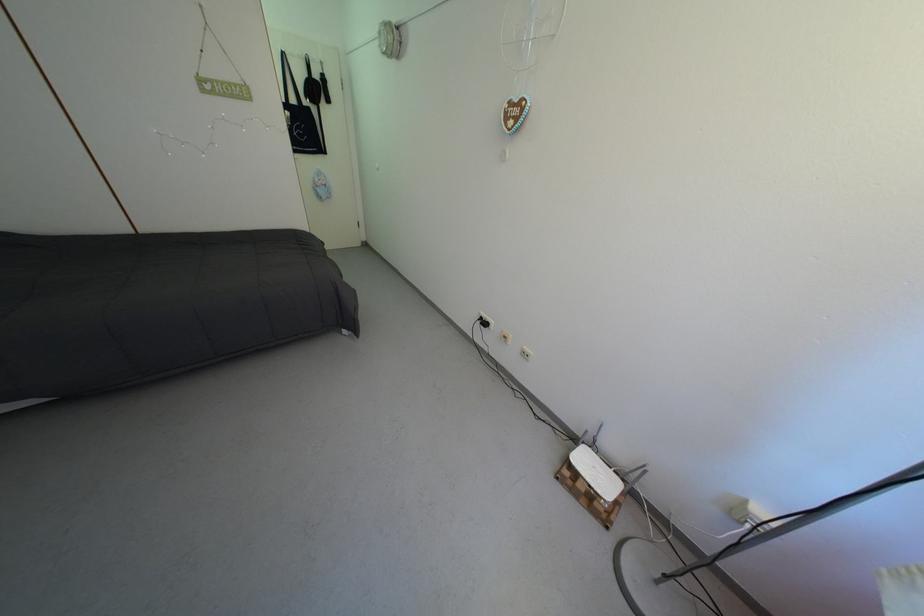
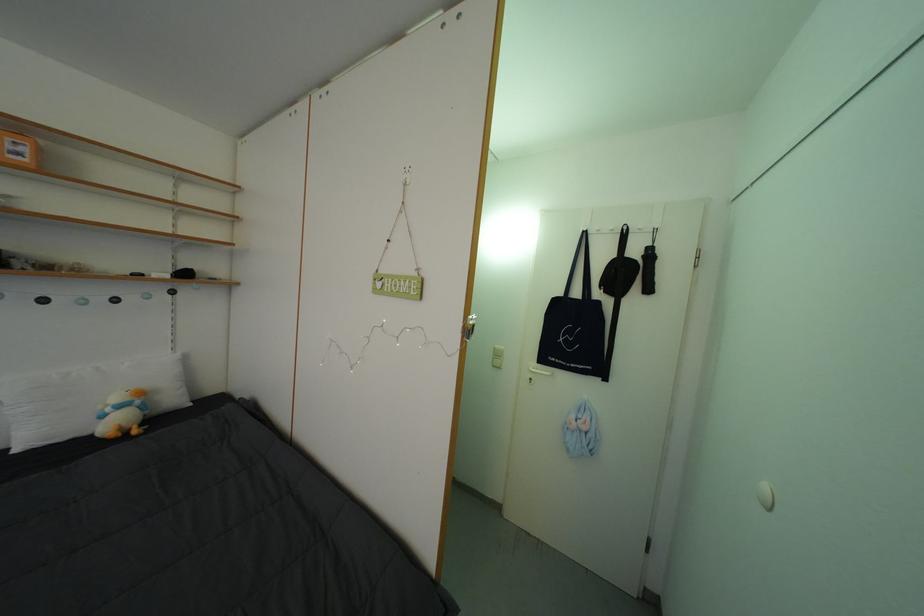
Find the pixel in the second image that matches pixel 301 107 in the first image.

(586, 300)